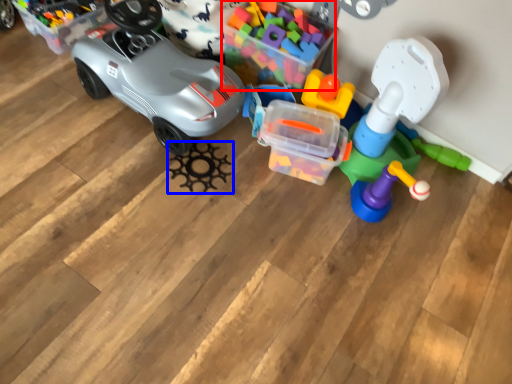
Question: Which object appears farthest to the camera in this image, toy (highlighted by a red box) or toy (highlighted by a blue box)?

Choices:
 (A) toy
 (B) toy

Answer: (B)